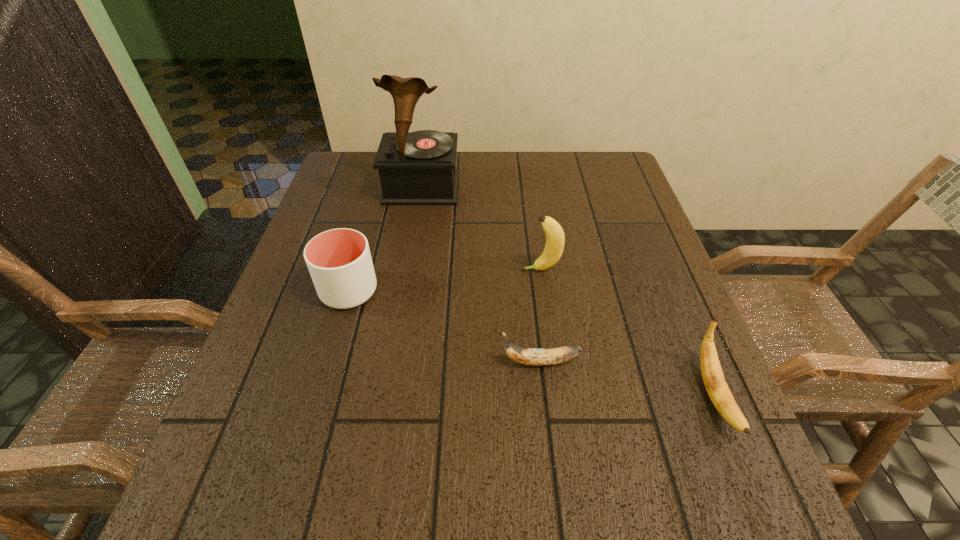
You are a GUI agent. You are given a task and a screenshot of the screen. Output one action in this format:
    pyautogui.click(x=<x>, y=<y>)
    Task: Click on the farthest object
    The image size is (960, 540).
    Given the screenshot: What is the action you would take?
    pyautogui.click(x=416, y=168)

Where is `the tallest object`? This screenshot has height=540, width=960. the tallest object is located at coordinates (416, 168).

Find the location of a particular element. Image resolution: width=960 pixels, height=540 pixels. the second tallest object is located at coordinates (555, 238).

The height and width of the screenshot is (540, 960). What are the coordinates of `the tallest banana` in the screenshot? It's located at click(555, 238).

Image resolution: width=960 pixels, height=540 pixels. What are the coordinates of `cup` in the screenshot? It's located at (339, 261).

You are a GUI agent. You are given a task and a screenshot of the screen. Output one action in this format:
    pyautogui.click(x=<x>, y=<y>)
    Task: Click on the second shortest object
    The height and width of the screenshot is (540, 960).
    Given the screenshot: What is the action you would take?
    pyautogui.click(x=713, y=377)

Locate an element on the screen. The image size is (960, 540). the rightmost banana is located at coordinates (713, 377).

At what (x,y) coordinates should I click in order to perform the action: click on the shortest object. Please return your answer as a coordinate pair (x, y). Looking at the image, I should click on (527, 356).

Identify the location of vacant region located at the horn opening of the tallest object. The height and width of the screenshot is (540, 960). (402, 307).

Locate an element on the screen. free space located 0.080m from the stem of the tallest banana is located at coordinates (485, 270).